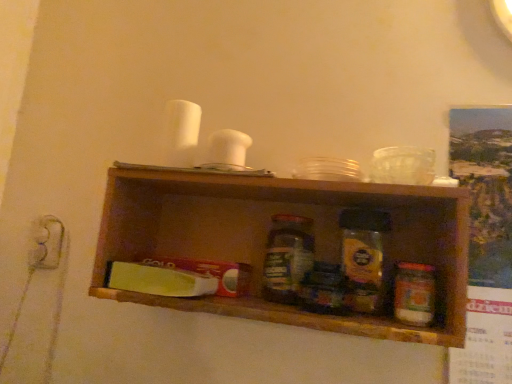
Question: Considering the relative sizes of green plastic butter at center and matte white electric outlet at left in the image provided, is green plastic butter at center taller than matte white electric outlet at left?

Choices:
 (A) yes
 (B) no

Answer: (B)

Question: From a real-world perspective, is green plastic butter at center below matte white electric outlet at left?

Choices:
 (A) yes
 (B) no

Answer: (A)

Question: Does green plastic butter at center come behind matte white electric outlet at left?

Choices:
 (A) yes
 (B) no

Answer: (B)

Question: Does green plastic butter at center have a larger size compared to matte white electric outlet at left?

Choices:
 (A) no
 (B) yes

Answer: (B)

Question: Are green plastic butter at center and matte white electric outlet at left beside each other?

Choices:
 (A) yes
 (B) no

Answer: (B)

Question: Visually, is matte white electric outlet at left positioned to the left or to the right of translucent plastic jar at center-right, the 2th bottle viewed from the left?

Choices:
 (A) right
 (B) left

Answer: (B)

Question: From the image's perspective, is matte white electric outlet at left located above or below translucent plastic jar at center-right, the 2th bottle positioned from the back?

Choices:
 (A) below
 (B) above

Answer: (B)

Question: Considering the positions of point (36, 223) and point (398, 317), is point (36, 223) closer or farther from the camera than point (398, 317)?

Choices:
 (A) farther
 (B) closer

Answer: (A)

Question: From a real-world perspective, is matte white electric outlet at left above or below translucent plastic jar at center-right, placed as the first bottle when sorted from right to left?

Choices:
 (A) above
 (B) below

Answer: (A)

Question: Considering the positions of translucent plastic jar at center-right, the 2th bottle positioned from the back, and wooden shelf at center in the image, is translucent plastic jar at center-right, the 2th bottle positioned from the back, bigger or smaller than wooden shelf at center?

Choices:
 (A) small
 (B) big

Answer: (A)

Question: In terms of width, does translucent plastic jar at center-right, the 2th bottle viewed from the left, look wider or thinner when compared to wooden shelf at center?

Choices:
 (A) wide
 (B) thin

Answer: (B)

Question: From their relative heights in the image, would you say translucent plastic jar at center-right, the 2th bottle positioned from the back, is taller or shorter than wooden shelf at center?

Choices:
 (A) short
 (B) tall

Answer: (A)

Question: Does point (418, 291) appear closer or farther from the camera than point (117, 297)?

Choices:
 (A) farther
 (B) closer

Answer: (B)

Question: From the image's perspective, is translucent glass jar at center, positioned as the 2th bottle in front-to-back order, located above or below wooden shelf at center?

Choices:
 (A) below
 (B) above

Answer: (A)

Question: Is translucent glass jar at center, the second bottle positioned from the right, in front of or behind wooden shelf at center in the image?

Choices:
 (A) behind
 (B) front

Answer: (A)